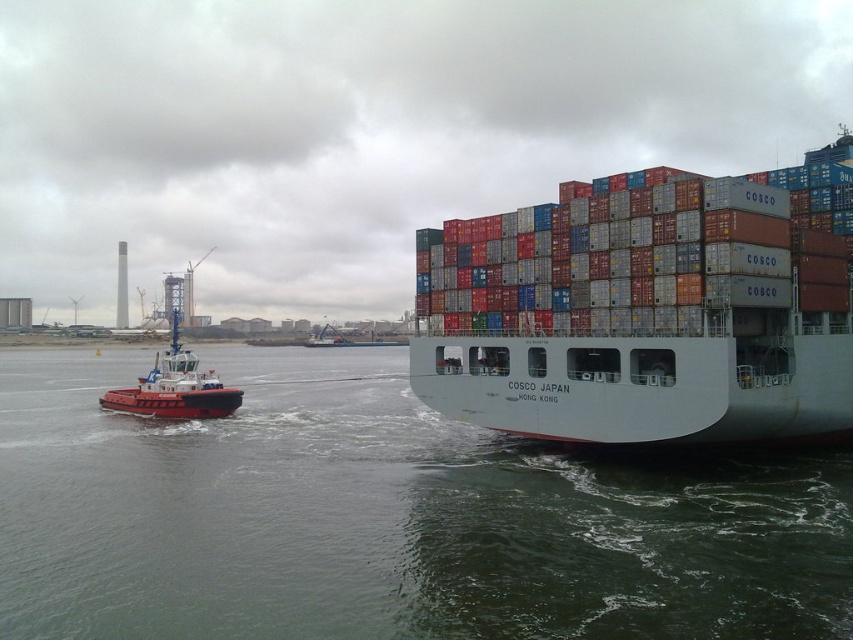
Question: Does white matte container ship at center appear on the right side of red matte tugboat at left?

Choices:
 (A) no
 (B) yes

Answer: (B)

Question: Which of the following is the farthest from the observer?

Choices:
 (A) (769, 173)
 (B) (657, 496)

Answer: (A)

Question: Which point is farther from the camera taking this photo?

Choices:
 (A) (416, 372)
 (B) (799, 588)
 (C) (222, 385)

Answer: (C)

Question: Among these objects, which one is nearest to the camera?

Choices:
 (A) white matte container ship at center
 (B) red matte tugboat at left

Answer: (A)

Question: Is the position of white matte container ship at center less distant than that of red matte tugboat at left?

Choices:
 (A) yes
 (B) no

Answer: (A)

Question: Can you confirm if clear water at lower left is positioned to the left of red matte tugboat at left?

Choices:
 (A) no
 (B) yes

Answer: (A)